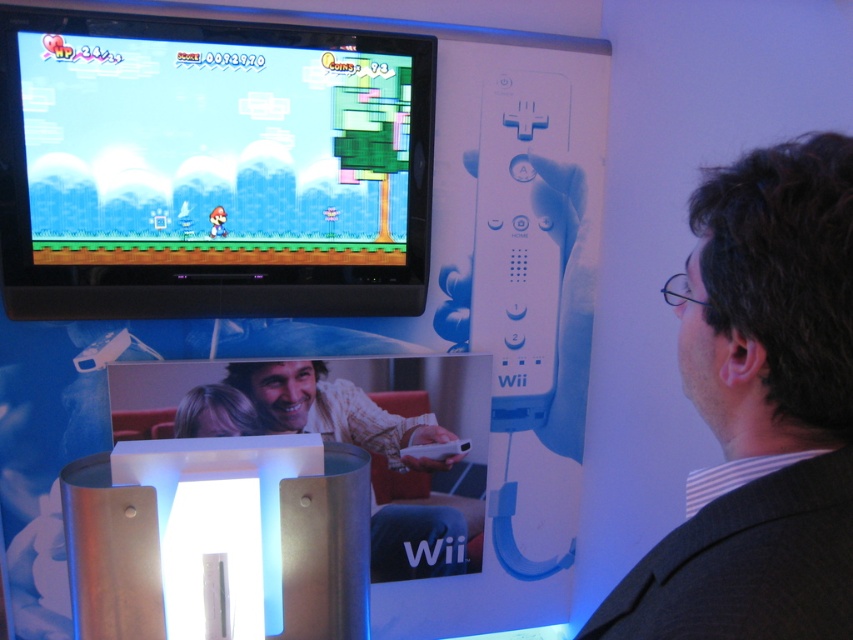
You are a game developer analyzing the Wii setup. You need to place a new controller on the screen at the exact coordinates of point (212, 168). What object will be covered by the controller?

The matte plastic screen at upper center is located at point (212, 168), so placing the controller there will cover it.

You are standing in front of the Nintendo Wii setup and want to reach the point marked at coordinates point (755, 317). If your arm can extend 24 inches, can you reach it?

The point (755, 317) is 25.07 inches away from you, which is slightly beyond your arm reach of 24 inches. Therefore, you cannot reach it with your current arm extension.

You are observing a group of people watching a Nintendo Wii game. Which person has a larger head size between the dark brown hair at upper right and the blonde hair at center?

The dark brown hair at upper right has a larger size compared to the blonde hair at center, so the person with dark brown hair at upper right has a larger head size.